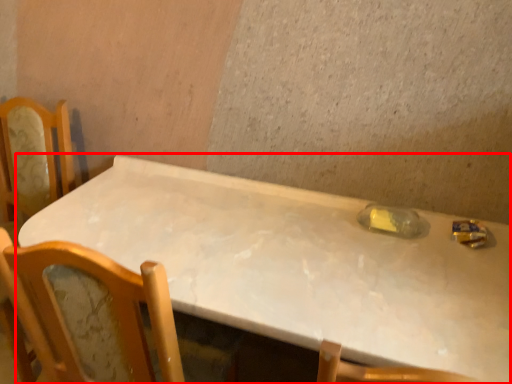
Question: From the image's perspective, where is table (annotated by the red box) located relative to bottle?

Choices:
 (A) below
 (B) above

Answer: (A)